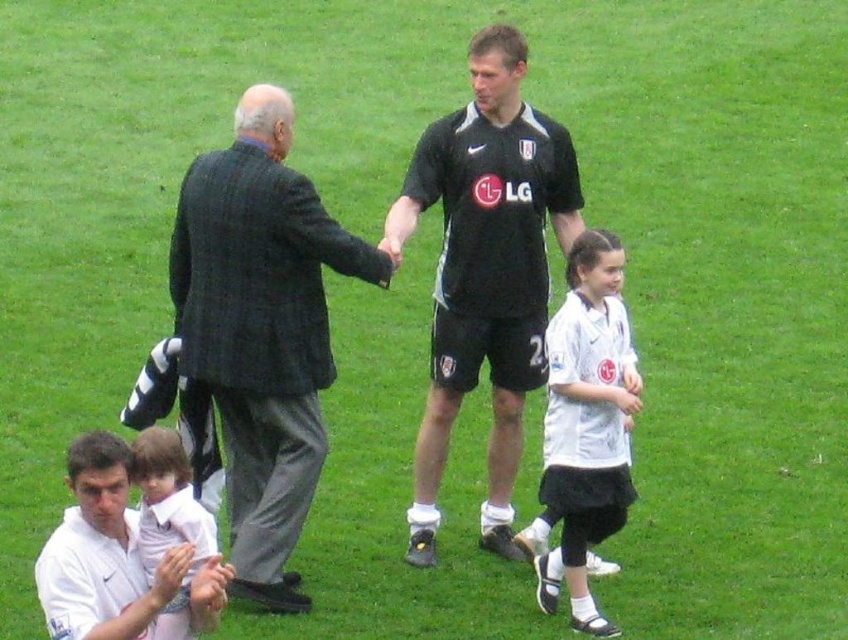
Describe the element at coordinates (484, 272) in the screenshot. I see `black jersey at center` at that location.

Is black jersey at center to the right of white jersey at center from the viewer's perspective?

No, black jersey at center is not to the right of white jersey at center.

Who is more distant from viewer, (512, 378) or (556, 392)?

Point (512, 378)

Where is `black jersey at center`? Image resolution: width=848 pixels, height=640 pixels. black jersey at center is located at coordinates (484, 272).

Does white jersey at center have a lesser width compared to light pink fabric at lower left?

Incorrect, white jersey at center's width is not less than light pink fabric at lower left's.

Where is `white jersey at center`? The height and width of the screenshot is (640, 848). white jersey at center is located at coordinates (586, 422).

Who is shorter, dark gray textured suit at left or white jersey at center?

Standing shorter between the two is white jersey at center.

The height and width of the screenshot is (640, 848). Find the location of `dark gray textured suit at left`. dark gray textured suit at left is located at coordinates (261, 330).

Locate an element on the screen. dark gray textured suit at left is located at coordinates (261, 330).